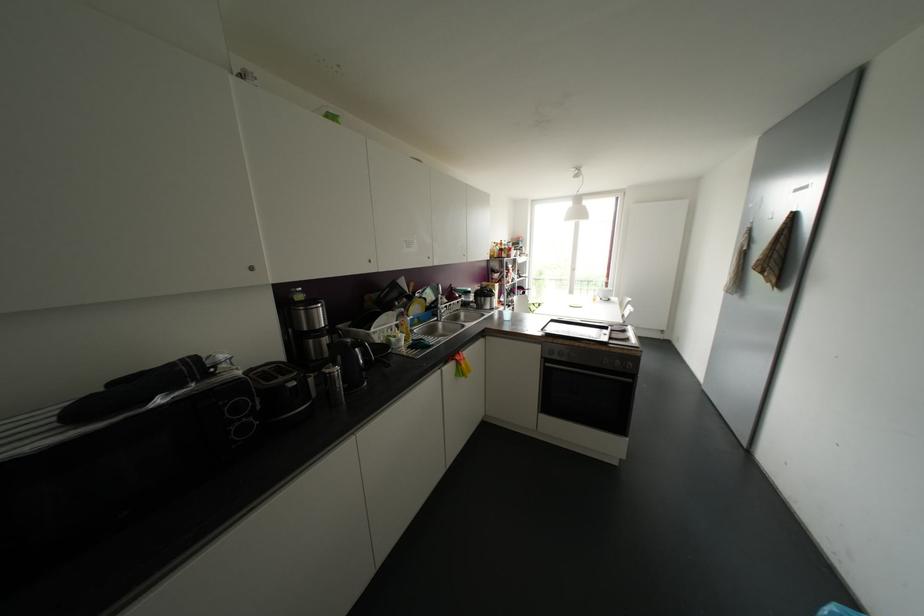
Describe the element at coordinates (624, 334) in the screenshot. I see `a oven control knob` at that location.